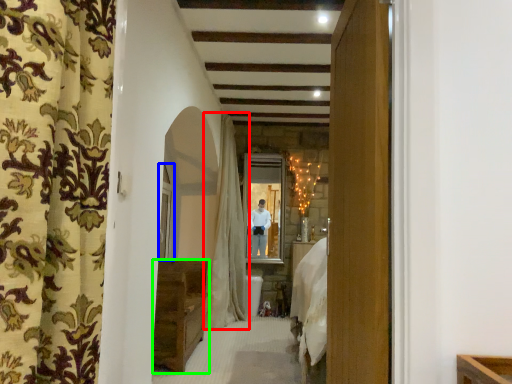
Question: Estimate the real-world distances between objects in this image. Which object is farther from curtain (highlighted by a red box), window (highlighted by a blue box) or furniture (highlighted by a green box)?

Choices:
 (A) window
 (B) furniture

Answer: (B)